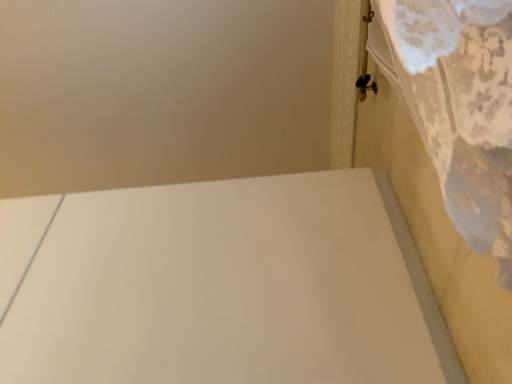
Locate an element on the screen. This screenshot has height=384, width=512. white lace sheet at upper right is located at coordinates (458, 105).

This screenshot has width=512, height=384. What do you see at coordinates (458, 105) in the screenshot? I see `white lace sheet at upper right` at bounding box center [458, 105].

The image size is (512, 384). What are the coordinates of `white lace sheet at upper right` in the screenshot? It's located at (458, 105).